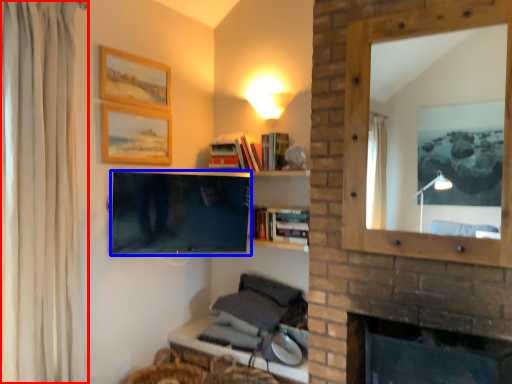
Question: Which point is closer to the camera, curtain (highlighted by a red box) or television (highlighted by a blue box)?

Choices:
 (A) curtain
 (B) television

Answer: (A)